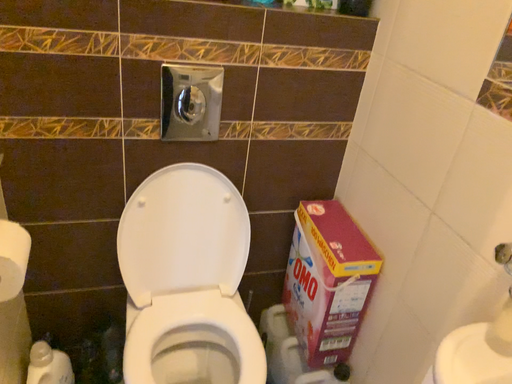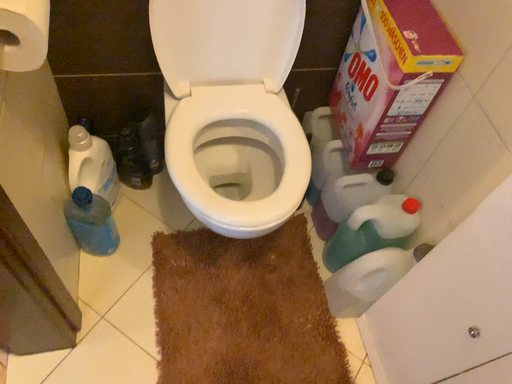
Question: Which way did the camera rotate in the video?

Choices:
 (A) rotated downward
 (B) rotated upward

Answer: (A)